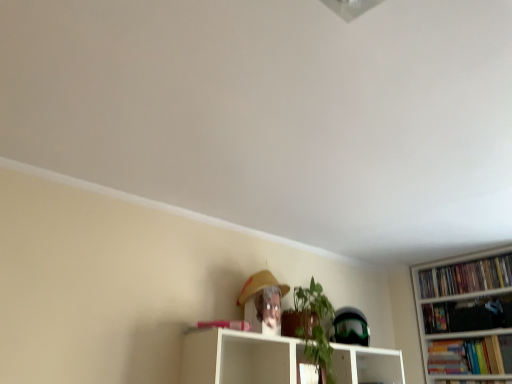
Question: Is hardcover books at right, arranged as the first book when viewed from the top, located outside white glossy shelf at center?

Choices:
 (A) no
 (B) yes

Answer: (B)

Question: Does hardcover books at right, arranged as the first book when viewed from the top, have a lesser height compared to white glossy shelf at center?

Choices:
 (A) yes
 (B) no

Answer: (A)

Question: Is the position of hardcover books at right, arranged as the first book when viewed from the top, less distant than that of white glossy shelf at center?

Choices:
 (A) no
 (B) yes

Answer: (A)

Question: Is white glossy shelf at center at the back of hardcover books at right, arranged as the first book when viewed from the top?

Choices:
 (A) no
 (B) yes

Answer: (A)

Question: From the image's perspective, is hardcover books at right, the 2th book in the bottom-to-top sequence, under white glossy shelf at center?

Choices:
 (A) no
 (B) yes

Answer: (A)

Question: Can you confirm if hardcover books at right, arranged as the first book when viewed from the top, is smaller than white glossy shelf at center?

Choices:
 (A) no
 (B) yes

Answer: (B)

Question: Considering the relative sizes of hardcover book at right, arranged as the second book when viewed from the top, and matte yellow straw hat at upper center in the image provided, is hardcover book at right, arranged as the second book when viewed from the top, smaller than matte yellow straw hat at upper center?

Choices:
 (A) no
 (B) yes

Answer: (B)

Question: From a real-world perspective, is hardcover book at right, the first book when ordered from bottom to top, physically above matte yellow straw hat at upper center?

Choices:
 (A) yes
 (B) no

Answer: (B)

Question: Does hardcover book at right, arranged as the second book when viewed from the top, have a greater width compared to matte yellow straw hat at upper center?

Choices:
 (A) yes
 (B) no

Answer: (B)

Question: Is hardcover book at right, arranged as the second book when viewed from the top, facing away from matte yellow straw hat at upper center?

Choices:
 (A) yes
 (B) no

Answer: (B)

Question: Is hardcover book at right, the first book when ordered from bottom to top, outside of matte yellow straw hat at upper center?

Choices:
 (A) no
 (B) yes

Answer: (B)

Question: From the image's perspective, is hardcover book at right, the first book when ordered from bottom to top, beneath matte yellow straw hat at upper center?

Choices:
 (A) yes
 (B) no

Answer: (A)

Question: From the image's perspective, is white glossy shelf at center over matte yellow straw hat at upper center?

Choices:
 (A) yes
 (B) no

Answer: (B)